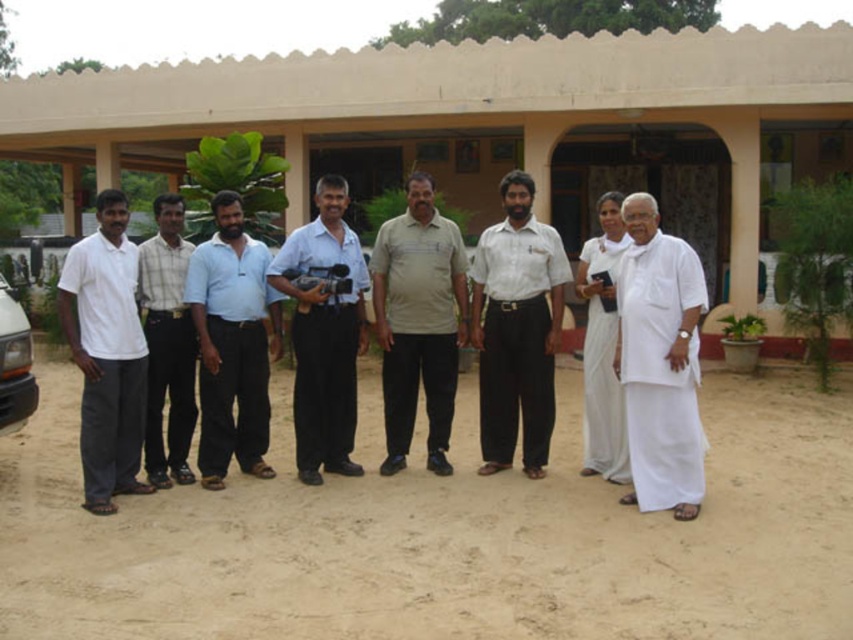
You are a photographer trying to capture a closeup shot of the white cotton dhoti at right and the white cotton shirt at center. Your camera has a maximum focus range of 35 inches. Can you capture both items in focus without moving the camera?

The white cotton dhoti at right and white cotton shirt at center are 35.78 inches apart. Since the distance between them exceeds the camera maximum focus range of 35 inches, you cannot capture both items in focus without moving the camera.

You are a photographer trying to capture a clear shot of the white cotton shirt at center and the white cotton dhoti at right. Since both are white, you need to adjust your camera settings to distinguish them. However, before doing so, you want to know which clothing item is closer to the camera. Can you determine which one is nearer based on their positions in the image?

The white cotton dhoti at right is in front of the white cotton shirt at center, so it is closer to the camera.

You are organizing a photo shoot and need to ensure that the white matte shirt at left and the light blue cotton shirt at center are visible in the frame. Given their sizes, which shirt should you focus on to ensure it doesn

The white matte shirt at left is larger in size than the light blue cotton shirt at center, so focusing on the white matte shirt at left will ensure it is visible in the frame.